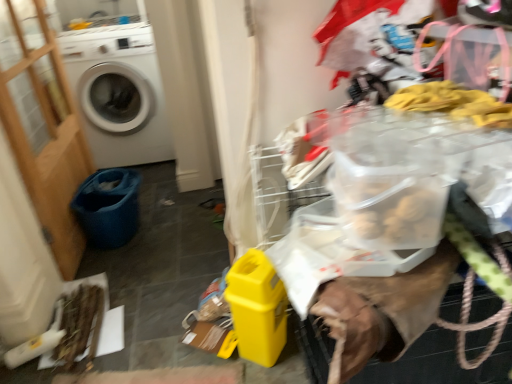
Question: Is white matte washing machine at left inside the boundaries of blue fabric bucket at lower left, or outside?

Choices:
 (A) outside
 (B) inside

Answer: (A)

Question: From a real-world perspective, is white matte washing machine at left above or below blue fabric bucket at lower left?

Choices:
 (A) below
 (B) above

Answer: (B)

Question: Which is nearer to the wooden screen door at left?

Choices:
 (A) blue fabric bucket at lower left
 (B) white matte washing machine at left

Answer: (A)

Question: Estimate the real-world distances between objects in this image. Which object is farther from the white matte washing machine at left?

Choices:
 (A) blue fabric bucket at lower left
 (B) wooden screen door at left

Answer: (A)